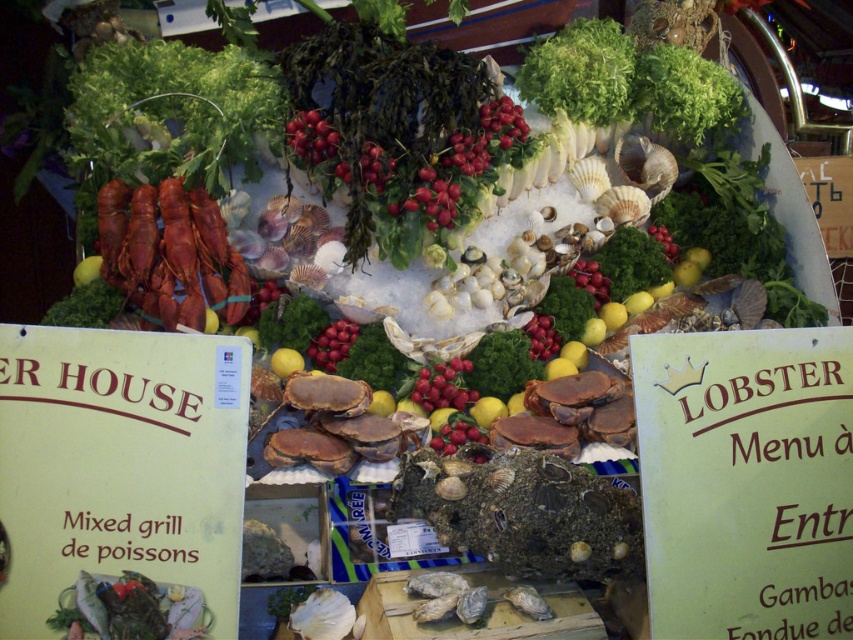
Between shiny red tomatoes at center and shiny red grapes at center, which one is positioned lower?

shiny red grapes at center is lower down.

Does shiny red tomatoes at center appear under shiny red grapes at center?

No, shiny red tomatoes at center is not below shiny red grapes at center.

Which is behind, point (289, 122) or point (325, 355)?

Positioned behind is point (289, 122).

This screenshot has height=640, width=853. In order to click on shiny red tomatoes at center in this screenshot , I will do `click(311, 138)`.